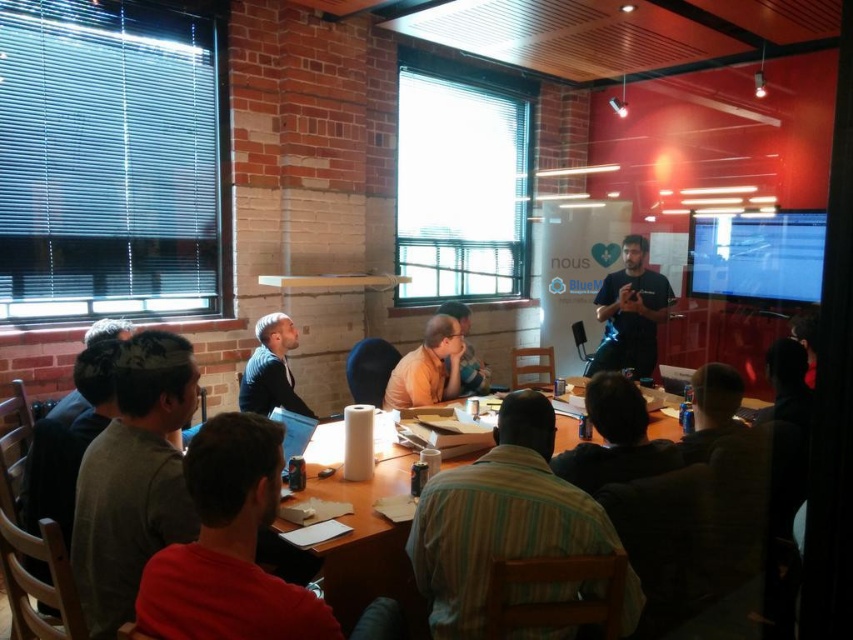
Question: Which point is closer to the camera taking this photo?

Choices:
 (A) (264, 381)
 (B) (630, 234)

Answer: (A)

Question: From the image, what is the correct spatial relationship of gray fabric shirt at left in relation to matte orange shirt at center?

Choices:
 (A) right
 (B) left

Answer: (B)

Question: Which point is closer to the camera taking this photo?

Choices:
 (A) (285, 333)
 (B) (642, 476)

Answer: (B)

Question: Does gray fabric shirt at left appear on the left side of matte black shirt at lower right?

Choices:
 (A) yes
 (B) no

Answer: (A)

Question: Can you confirm if dark blue t-shirt at center is positioned below matte orange shirt at center?

Choices:
 (A) no
 (B) yes

Answer: (A)

Question: Among these objects, which one is nearest to the camera?

Choices:
 (A) dark blue t-shirt at center
 (B) wooden table at center
 (C) matte orange shirt at center

Answer: (B)